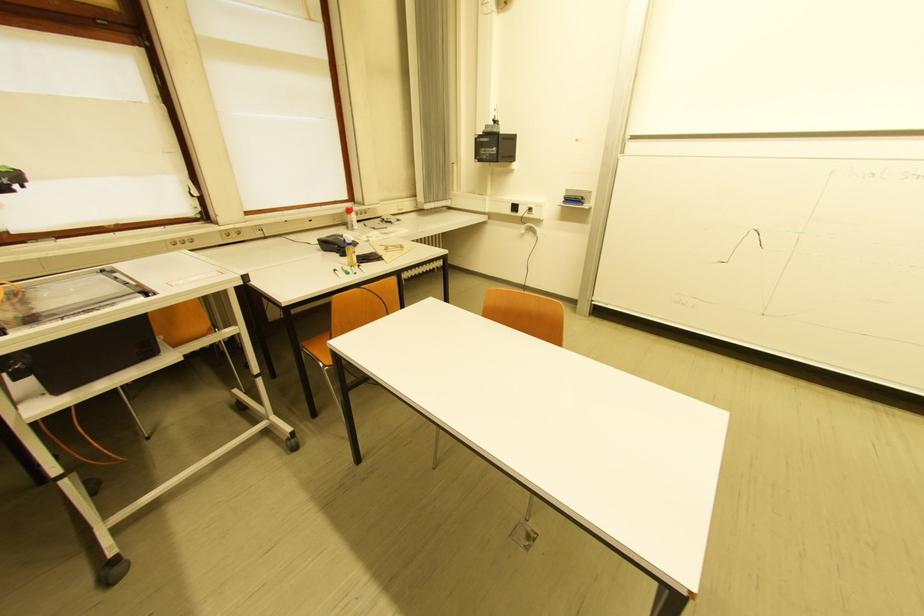
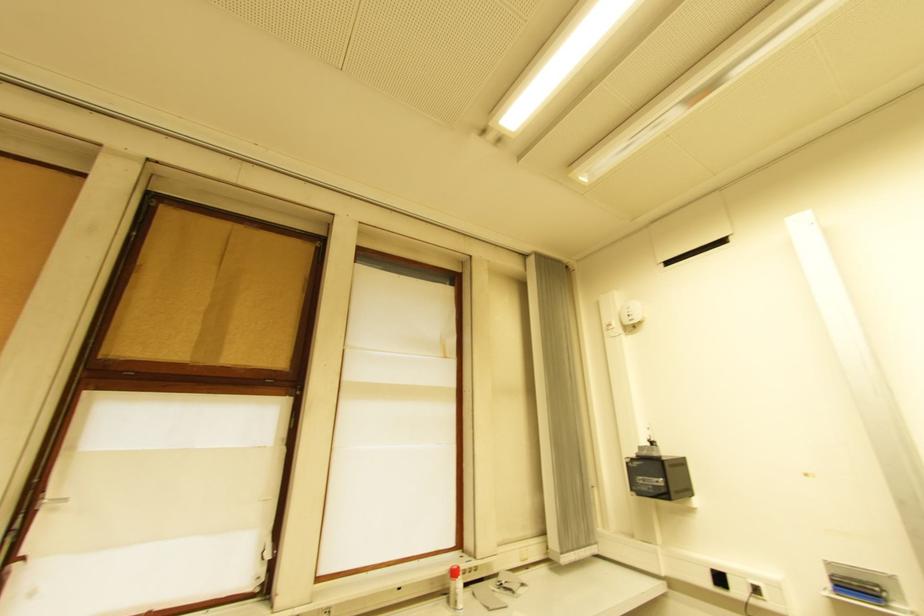
The images are taken continuously from a first-person perspective. In which direction is your viewpoint rotating?

The camera's rotation is toward left-up.